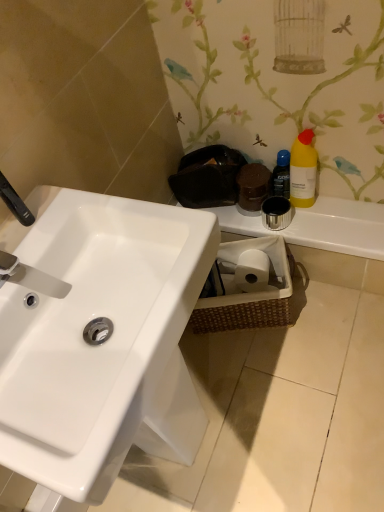
Where is `vacant space situated above metallic silver cup at upper right (from a real-world perspective)`? vacant space situated above metallic silver cup at upper right (from a real-world perspective) is located at coordinates (309, 216).